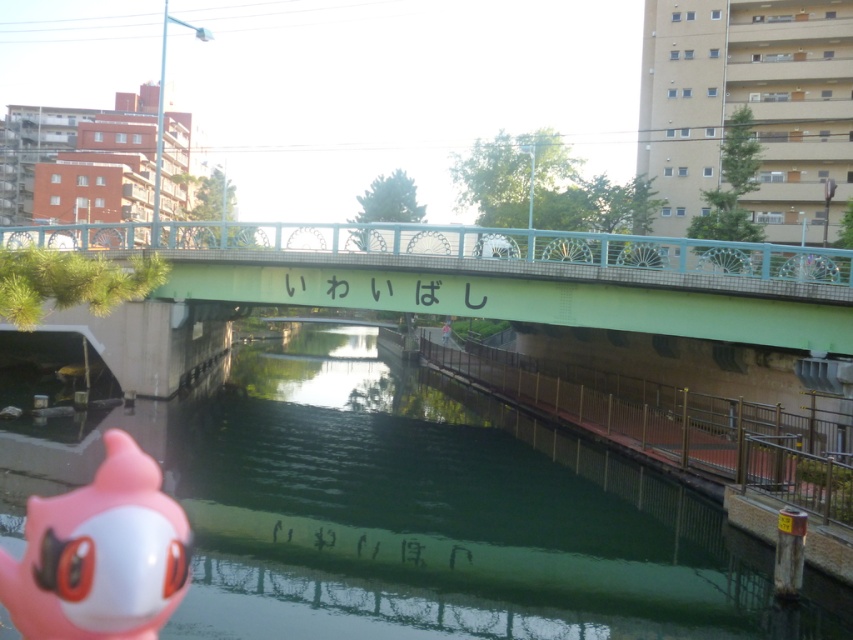
You are a delivery drone that needs to fly from the pink rubber toy at lower left to the green concrete bridge at center. Considering the height difference between them, can you safely ascend vertically without hitting any obstacles?

The green concrete bridge at center is much taller than the pink rubber toy at lower left, so yes, the drone can safely ascend vertically to reach the green concrete bridge at center without hitting obstacles.

You are a photographer standing at the lower right corner of the image. You want to capture a reflection of the Iwai Bridge in the green smooth water at center. Considering the position of the brown metal railing at lower right, will the railing block your view of the water? Please explain.

The green smooth water at center is much taller than the brown metal railing at lower right. Since the water is taller, it means the water is higher in elevation compared to the railing. Therefore, the railing at lower right would not block your view of the water because the water is positioned higher up in the scene.

You are a tourist holding a map and want to cross the green concrete bridge at center to reach the other side of the canal. However, you notice the green smooth water at center. Where should you walk to avoid stepping into the water?

To avoid stepping into the green smooth water at center, you should walk to the right side of the green concrete bridge at center since the water is on the left side.